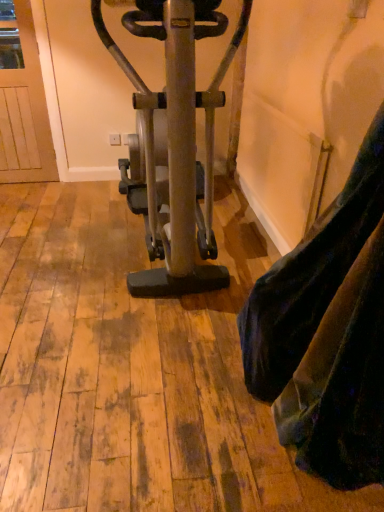
In order to click on empty space that is in between velvet-like fabric at lower right and metallic gold stationary bicycle at center in this screenshot , I will do tap(205, 330).